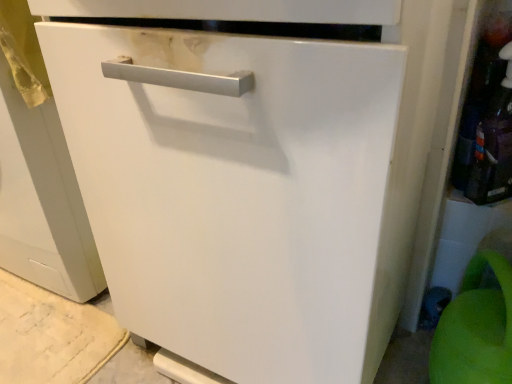
At what (x,y) coordinates should I click in order to perform the action: click on white glossy door at center. Please return your answer as a coordinate pair (x, y). Looking at the image, I should click on (237, 194).

In order to face white glossy door at center, should I rotate leftwards or rightwards?

You should rotate left by 0.191 degrees.

What do you see at coordinates (237, 194) in the screenshot?
I see `white glossy door at center` at bounding box center [237, 194].

At what (x,y) coordinates should I click in order to perform the action: click on white glossy door at center. Please return your answer as a coordinate pair (x, y). Looking at the image, I should click on (237, 194).